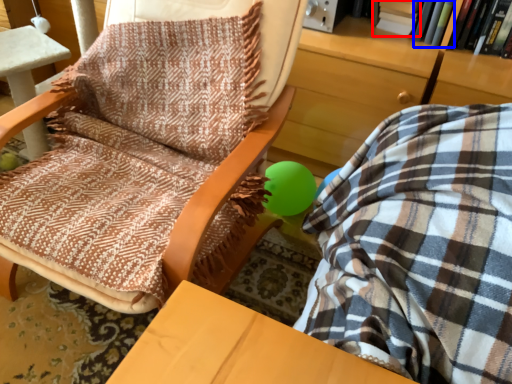
Question: Among these objects, which one is farthest to the camera, book (highlighted by a red box) or book (highlighted by a blue box)?

Choices:
 (A) book
 (B) book

Answer: (A)